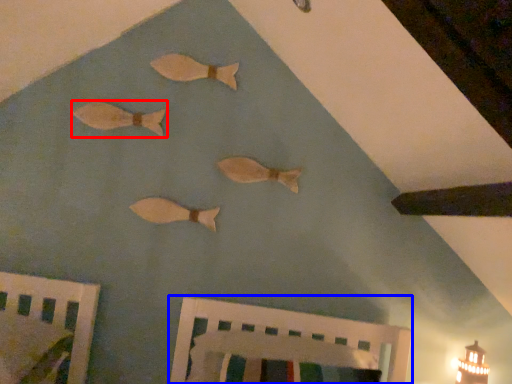
Question: Which object appears farthest to the camera in this image, fish (highlighted by a red box) or furniture (highlighted by a blue box)?

Choices:
 (A) fish
 (B) furniture

Answer: (A)